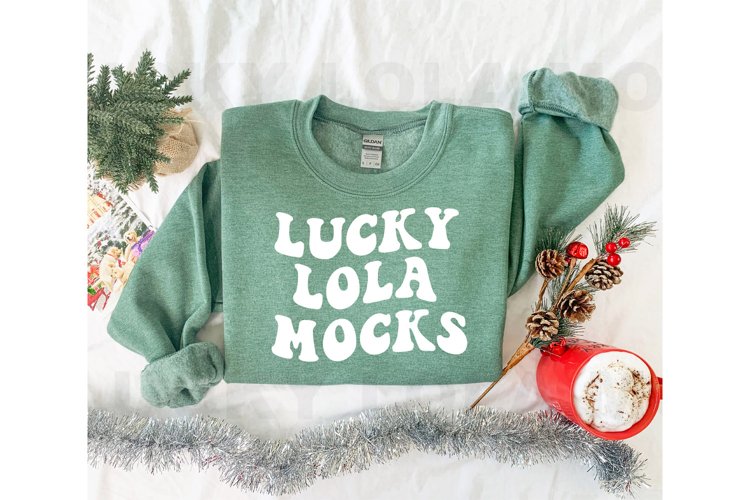
Where is `white sheet`? This screenshot has height=500, width=750. white sheet is located at coordinates (426, 78).